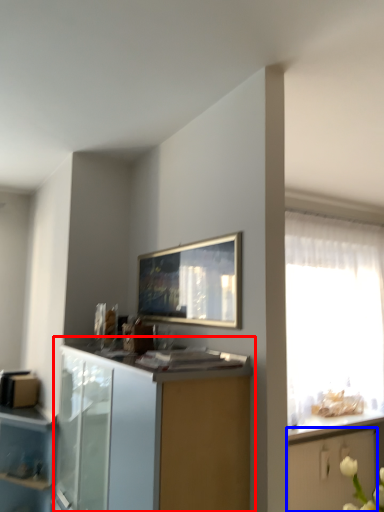
Question: Which point is closer to the camera, cabinetry (highlighted by a red box) or cabinetry (highlighted by a blue box)?

Choices:
 (A) cabinetry
 (B) cabinetry

Answer: (A)